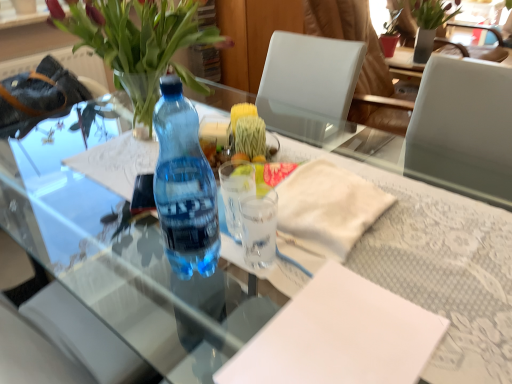
This screenshot has height=384, width=512. Identify the location of vacant space to the right of transparent glass cup at center, acting as the 1th coffee cup starting from the front. (343, 247).